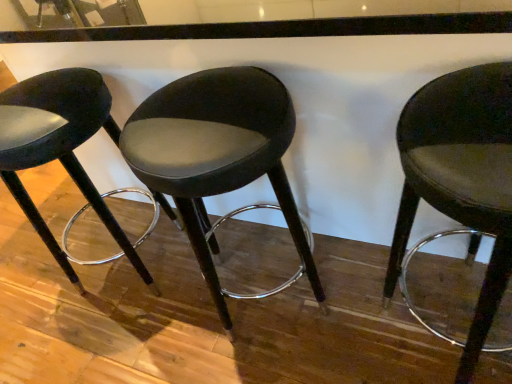
At what (x,y) coordinates should I click in order to perform the action: click on satin black stool at left, acting as the 1th chair starting from the left. Please return your answer as a coordinate pair (x, y). This screenshot has width=512, height=384. Looking at the image, I should click on (58, 145).

Image resolution: width=512 pixels, height=384 pixels. Describe the element at coordinates (461, 179) in the screenshot. I see `matte black stool at right, which is the 3th chair from left to right` at that location.

Where is `suede-like black stool at center, arranged as the second chair when viewed from the left`? The image size is (512, 384). suede-like black stool at center, arranged as the second chair when viewed from the left is located at coordinates (217, 156).

Which object is further away from the camera, satin black stool at left, which ranks as the third chair in right-to-left order, or matte black stool at right, which is the 3th chair from left to right?

satin black stool at left, which ranks as the third chair in right-to-left order, is more distant.

Are satin black stool at left, acting as the 1th chair starting from the left, and matte black stool at right, placed as the 1th chair when sorted from right to left, located far from each other?

satin black stool at left, acting as the 1th chair starting from the left, is near matte black stool at right, placed as the 1th chair when sorted from right to left, not far away.

Does satin black stool at left, acting as the 1th chair starting from the left, have a larger size compared to matte black stool at right, which is the 3th chair from left to right?

Indeed, satin black stool at left, acting as the 1th chair starting from the left, has a larger size compared to matte black stool at right, which is the 3th chair from left to right.

Does satin black stool at left, acting as the 1th chair starting from the left, turn towards matte black stool at right, which is the 3th chair from left to right?

No, satin black stool at left, acting as the 1th chair starting from the left, is not turned towards matte black stool at right, which is the 3th chair from left to right.

Between suede-like black stool at center, arranged as the second chair when viewed from the left, and satin black stool at left, which ranks as the third chair in right-to-left order, which one is positioned behind?

satin black stool at left, which ranks as the third chair in right-to-left order, is more distant.

Choose the correct answer: Is suede-like black stool at center, the 2th chair positioned from the right, inside satin black stool at left, acting as the 1th chair starting from the left, or outside it?

suede-like black stool at center, the 2th chair positioned from the right, is not enclosed by satin black stool at left, acting as the 1th chair starting from the left.

Does point (250, 119) appear closer or farther from the camera than point (119, 237)?

Point (250, 119) is closer to the camera than point (119, 237).

Find the location of `the 1st chair in front of the satin black stool at left, which ranks as the third chair in right-to-left order, starting your count from the anchor`. the 1st chair in front of the satin black stool at left, which ranks as the third chair in right-to-left order, starting your count from the anchor is located at coordinates (217, 156).

In the image, is suede-like black stool at center, arranged as the second chair when viewed from the left, positioned in front of or behind matte black stool at right, placed as the 1th chair when sorted from right to left?

suede-like black stool at center, arranged as the second chair when viewed from the left, is positioned farther from the viewer than matte black stool at right, placed as the 1th chair when sorted from right to left.

From a real-world perspective, which is physically below, suede-like black stool at center, arranged as the second chair when viewed from the left, or matte black stool at right, placed as the 1th chair when sorted from right to left?

matte black stool at right, placed as the 1th chair when sorted from right to left, from a real-world perspective.

From the image's perspective, is suede-like black stool at center, the 2th chair positioned from the right, on top of matte black stool at right, which is the 3th chair from left to right?

Yes, from the image's perspective, suede-like black stool at center, the 2th chair positioned from the right, is on top of matte black stool at right, which is the 3th chair from left to right.

Is suede-like black stool at center, arranged as the second chair when viewed from the left, directly adjacent to matte black stool at right, which is the 3th chair from left to right?

suede-like black stool at center, arranged as the second chair when viewed from the left, and matte black stool at right, which is the 3th chair from left to right, are not in contact.

The image size is (512, 384). Identify the location of chair lying on the right of suede-like black stool at center, arranged as the second chair when viewed from the left. (461, 179).

From the image's perspective, which one is positioned lower, matte black stool at right, placed as the 1th chair when sorted from right to left, or suede-like black stool at center, arranged as the second chair when viewed from the left?

matte black stool at right, placed as the 1th chair when sorted from right to left, from the image's perspective.

Is point (399, 238) positioned in front of point (230, 74)?

Yes, it is in front of point (230, 74).

Is the depth of matte black stool at right, which is the 3th chair from left to right, greater than that of suede-like black stool at center, the 2th chair positioned from the right?

No, matte black stool at right, which is the 3th chair from left to right, is closer to the viewer.

Is matte black stool at right, placed as the 1th chair when sorted from right to left, oriented away from satin black stool at left, which ranks as the third chair in right-to-left order?

No, matte black stool at right, placed as the 1th chair when sorted from right to left, is not facing the opposite direction of satin black stool at left, which ranks as the third chair in right-to-left order.

From a real-world perspective, is matte black stool at right, placed as the 1th chair when sorted from right to left, beneath satin black stool at left, which ranks as the third chair in right-to-left order?

Yes, from a real-world perspective, matte black stool at right, placed as the 1th chair when sorted from right to left, is beneath satin black stool at left, which ranks as the third chair in right-to-left order.

Which object is positioned more to the right, matte black stool at right, placed as the 1th chair when sorted from right to left, or satin black stool at left, acting as the 1th chair starting from the left?

From the viewer's perspective, matte black stool at right, placed as the 1th chair when sorted from right to left, appears more on the right side.

Can you confirm if matte black stool at right, placed as the 1th chair when sorted from right to left, is wider than satin black stool at left, which ranks as the third chair in right-to-left order?

No.

Are satin black stool at left, acting as the 1th chair starting from the left, and suede-like black stool at center, the 2th chair positioned from the right, making contact?

satin black stool at left, acting as the 1th chair starting from the left, and suede-like black stool at center, the 2th chair positioned from the right, are clearly separated.

Looking at this image, which is in front, satin black stool at left, acting as the 1th chair starting from the left, or suede-like black stool at center, the 2th chair positioned from the right?

suede-like black stool at center, the 2th chair positioned from the right, is in front.

Between satin black stool at left, acting as the 1th chair starting from the left, and suede-like black stool at center, the 2th chair positioned from the right, which one appears on the right side from the viewer's perspective?

suede-like black stool at center, the 2th chair positioned from the right, is more to the right.

Considering the relative sizes of satin black stool at left, acting as the 1th chair starting from the left, and suede-like black stool at center, the 2th chair positioned from the right, in the image provided, is satin black stool at left, acting as the 1th chair starting from the left, thinner than suede-like black stool at center, the 2th chair positioned from the right,?

In fact, satin black stool at left, acting as the 1th chair starting from the left, might be wider than suede-like black stool at center, the 2th chair positioned from the right.

At what (x,y) coordinates should I click in order to perform the action: click on the 2nd chair below the satin black stool at left, acting as the 1th chair starting from the left (from the image's perspective). Please return your answer as a coordinate pair (x, y). This screenshot has width=512, height=384. Looking at the image, I should click on (461, 179).

Locate an element on the screen. The height and width of the screenshot is (384, 512). chair that is the 1st one when counting forward from the satin black stool at left, which ranks as the third chair in right-to-left order is located at coordinates (217, 156).

Which object lies further to the anchor point suede-like black stool at center, the 2th chair positioned from the right, satin black stool at left, which ranks as the third chair in right-to-left order, or matte black stool at right, which is the 3th chair from left to right?

The object further to suede-like black stool at center, the 2th chair positioned from the right, is satin black stool at left, which ranks as the third chair in right-to-left order.

Considering their positions, is suede-like black stool at center, arranged as the second chair when viewed from the left, positioned further to satin black stool at left, acting as the 1th chair starting from the left, than matte black stool at right, which is the 3th chair from left to right?

matte black stool at right, which is the 3th chair from left to right, lies further to satin black stool at left, acting as the 1th chair starting from the left, than the other object.

Which object lies further to the anchor point matte black stool at right, which is the 3th chair from left to right, suede-like black stool at center, arranged as the second chair when viewed from the left, or satin black stool at left, acting as the 1th chair starting from the left?

The object further to matte black stool at right, which is the 3th chair from left to right, is satin black stool at left, acting as the 1th chair starting from the left.

Which object lies nearer to the anchor point satin black stool at left, acting as the 1th chair starting from the left, matte black stool at right, placed as the 1th chair when sorted from right to left, or suede-like black stool at center, the 2th chair positioned from the right?

suede-like black stool at center, the 2th chair positioned from the right, is positioned closer to the anchor satin black stool at left, acting as the 1th chair starting from the left.

From the image, which object appears to be farther from suede-like black stool at center, arranged as the second chair when viewed from the left, matte black stool at right, which is the 3th chair from left to right, or satin black stool at left, which ranks as the third chair in right-to-left order?

satin black stool at left, which ranks as the third chair in right-to-left order, is further to suede-like black stool at center, arranged as the second chair when viewed from the left.

Estimate the real-world distances between objects in this image. Which object is further from matte black stool at right, which is the 3th chair from left to right, satin black stool at left, acting as the 1th chair starting from the left, or suede-like black stool at center, the 2th chair positioned from the right?

The object further to matte black stool at right, which is the 3th chair from left to right, is satin black stool at left, acting as the 1th chair starting from the left.

Identify the location of chair situated between satin black stool at left, acting as the 1th chair starting from the left, and matte black stool at right, which is the 3th chair from left to right, from left to right. Image resolution: width=512 pixels, height=384 pixels. (217, 156).